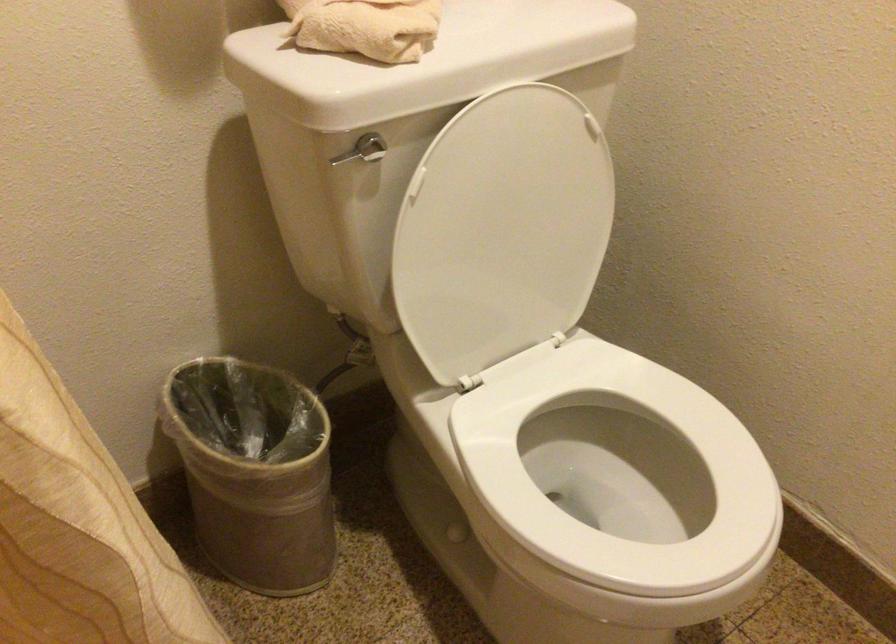
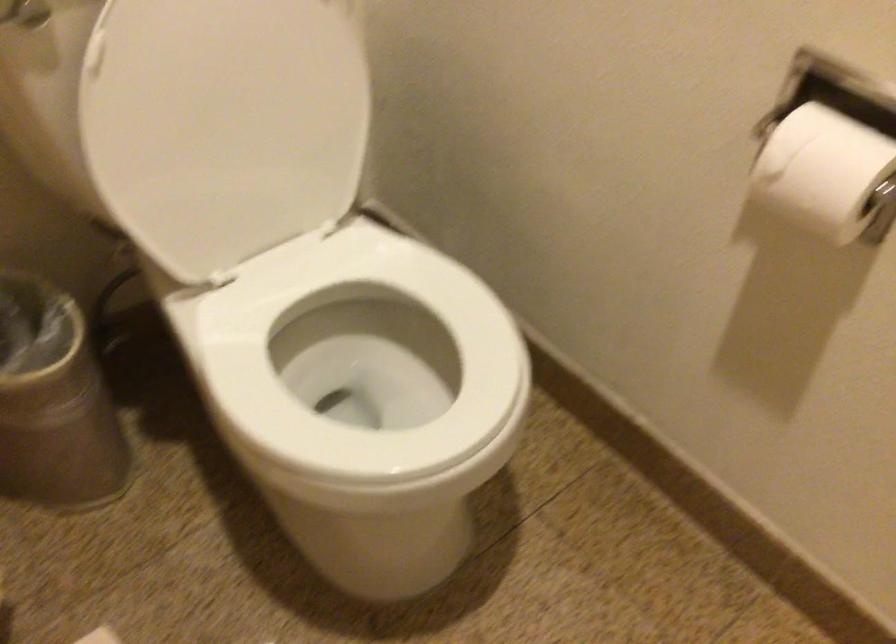
Find the pixel in the second image that matches (507,232) in the first image.

(239, 114)